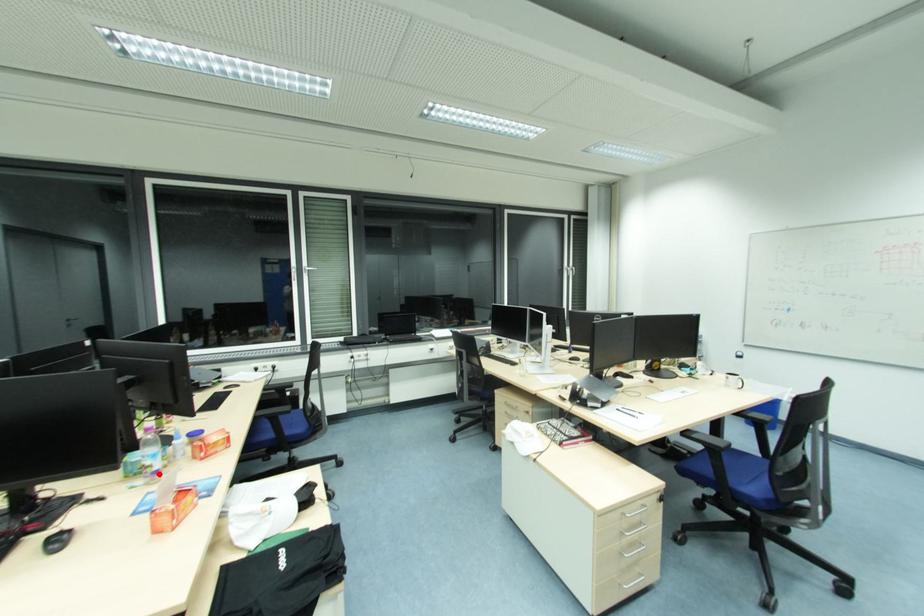
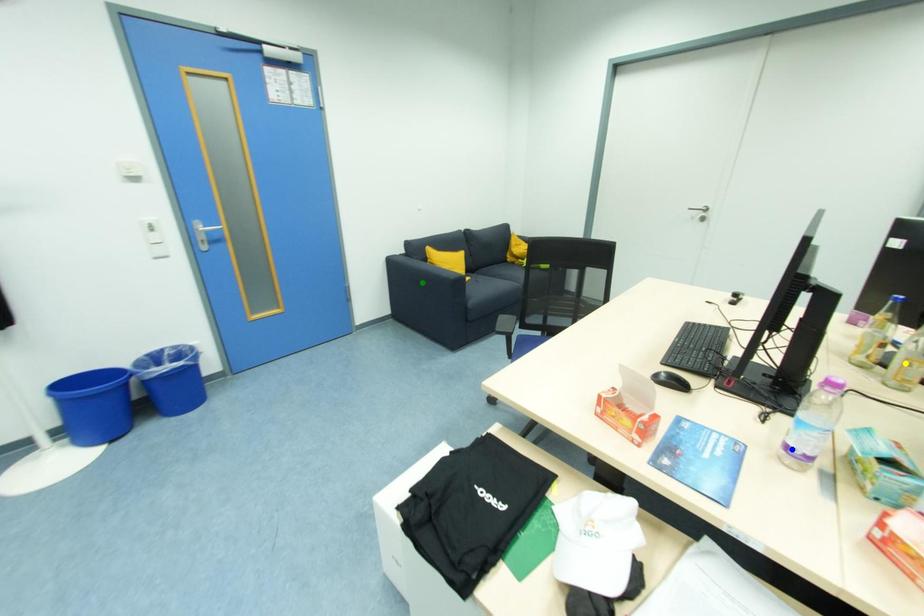
Question: I am providing you with two images of the same scene from different viewpoints. A red point is marked on the first image. You are given multiple points on the second image. Which point in image 2 is actually the same real-world point as the red point in image 1?

Choices:
 (A) green point
 (B) yellow point
 (C) blue point

Answer: (C)